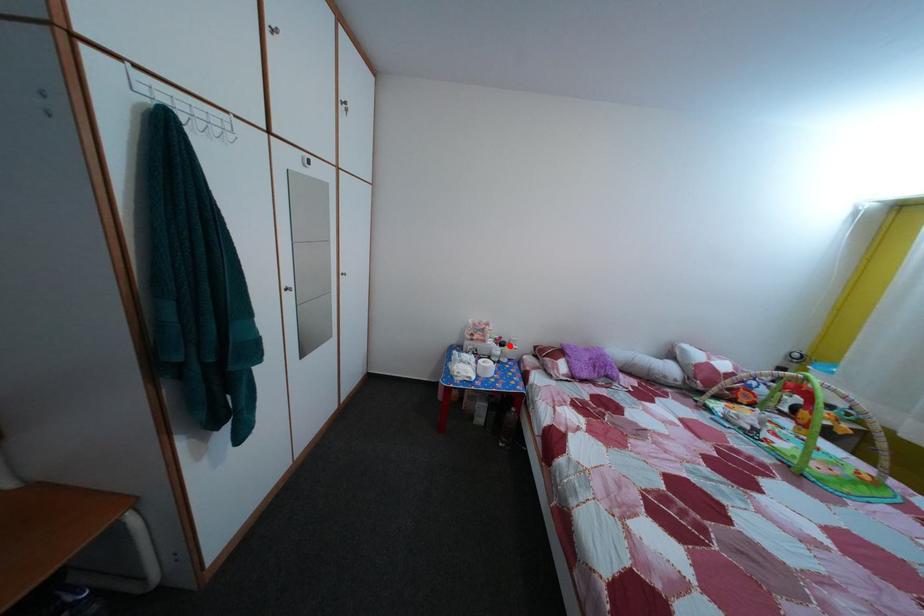
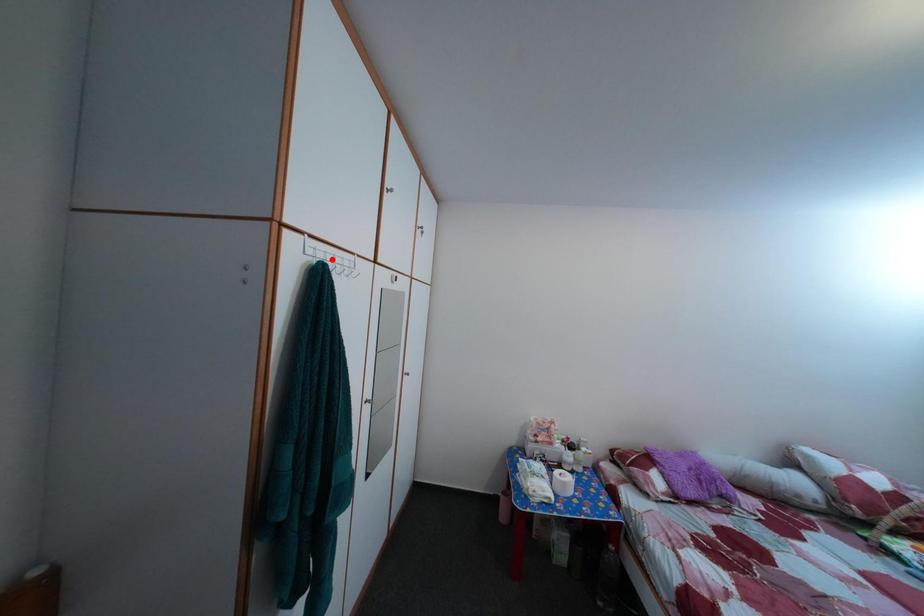
I am providing you with two images of the same scene from different viewpoints. A red point is marked on the first image and another point is marked on the second image. Is the marked point in image1 the same physical position as the marked point in image2?

No